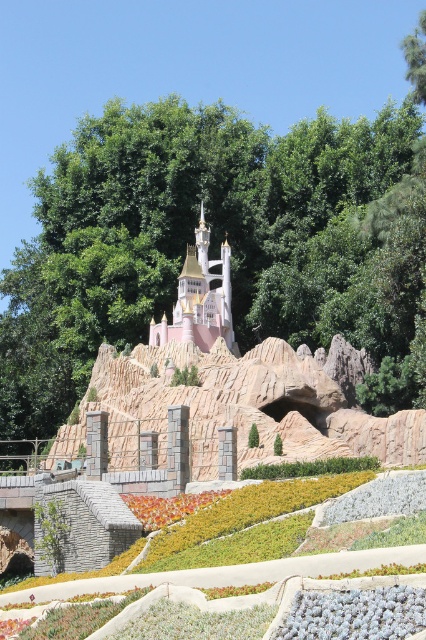
Question: Which of the following is the farthest from the observer?

Choices:
 (A) (180, 320)
 (B) (164, 524)

Answer: (A)

Question: Does pastel pink stone castle at center appear under vibrant orange petals at center?

Choices:
 (A) no
 (B) yes

Answer: (A)

Question: Which point appears farthest from the camera in this image?

Choices:
 (A) (215, 292)
 (B) (160, 508)

Answer: (A)

Question: Observing the image, what is the correct spatial positioning of pastel pink stone castle at center in reference to vibrant orange petals at center?

Choices:
 (A) above
 (B) below

Answer: (A)

Question: Can you confirm if pastel pink stone castle at center is smaller than vibrant orange petals at center?

Choices:
 (A) yes
 (B) no

Answer: (B)

Question: Which of the following is the closest to the observer?

Choices:
 (A) (198, 234)
 (B) (164, 499)

Answer: (B)